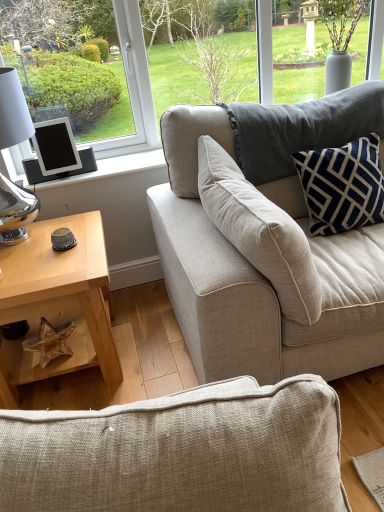
This screenshot has height=512, width=384. In order to click on light wood/texture coffee table at lower left in this screenshot , I will do `click(58, 300)`.

Where is `black matte tablet at left`? This screenshot has height=512, width=384. black matte tablet at left is located at coordinates (56, 147).

Where is `beige fabric couch at upper right`? beige fabric couch at upper right is located at coordinates (267, 241).

Locate an element on the screen. The image size is (384, 512). light wood/texture coffee table at lower left is located at coordinates (58, 300).

How different are the orientations of black matte tablet at left and beige fabric couch at upper right in degrees?

black matte tablet at left and beige fabric couch at upper right are facing 82.7 degrees away from each other.

Would you say beige fabric couch at upper right is part of black matte tablet at left's contents?

No, black matte tablet at left does not contain beige fabric couch at upper right.

This screenshot has height=512, width=384. In the image, there is a beige fabric couch at upper right. Find the location of `computer monitor above it (from the image's perspective)`. computer monitor above it (from the image's perspective) is located at coordinates (56, 147).

Are black matte tablet at left and beige fabric couch at upper right located far from each other?

black matte tablet at left is actually quite close to beige fabric couch at upper right.

Consider the image. Would you say light wood/texture coffee table at lower left is to the left or to the right of black matte tablet at left in the picture?

light wood/texture coffee table at lower left is positioned on black matte tablet at left's right side.

From a real-world perspective, between light wood/texture coffee table at lower left and black matte tablet at left, who is vertically higher?

black matte tablet at left is physically above.

Is light wood/texture coffee table at lower left bigger than black matte tablet at left?

Correct, light wood/texture coffee table at lower left is larger in size than black matte tablet at left.

Where is `coffee table that is under the black matte tablet at left (from a real-world perspective)`? The height and width of the screenshot is (512, 384). coffee table that is under the black matte tablet at left (from a real-world perspective) is located at coordinates (58, 300).

The image size is (384, 512). Identify the location of coffee table below the navy velvet pillow at upper right (from the image's perspective). (58, 300).

Can you tell me how much navy velvet pillow at upper right and light wood/texture coffee table at lower left differ in facing direction?

1.92 degrees.

From the image's perspective, between navy velvet pillow at upper right and light wood/texture coffee table at lower left, who is located below?

light wood/texture coffee table at lower left.

Is navy velvet pillow at upper right not inside light wood/texture coffee table at lower left?

Yes.

Consider the image. Considering the relative sizes of navy velvet pillow at upper right and black matte tablet at left in the image provided, is navy velvet pillow at upper right bigger than black matte tablet at left?

Yes.

Where is `computer monitor above the navy velvet pillow at upper right (from a real-world perspective)`? This screenshot has width=384, height=512. computer monitor above the navy velvet pillow at upper right (from a real-world perspective) is located at coordinates click(56, 147).

Is navy velvet pillow at upper right with black matte tablet at left?

No, navy velvet pillow at upper right is not beside black matte tablet at left.

Which is nearer, (x=383, y=176) or (x=68, y=144)?

The point (x=383, y=176) is closer.

Considering the relative positions of light wood/texture coffee table at lower left and beige fabric couch at upper right in the image provided, is light wood/texture coffee table at lower left behind beige fabric couch at upper right?

That is True.

From the image's perspective, which is below, light wood/texture coffee table at lower left or beige fabric couch at upper right?

light wood/texture coffee table at lower left.

Considering the sizes of light wood/texture coffee table at lower left and beige fabric couch at upper right in the image, is light wood/texture coffee table at lower left wider or thinner than beige fabric couch at upper right?

Clearly, light wood/texture coffee table at lower left has more width compared to beige fabric couch at upper right.

Is beige fabric couch at upper right positioned with its back to navy velvet pillow at upper right?

No, beige fabric couch at upper right is not facing away from navy velvet pillow at upper right.

Between beige fabric couch at upper right and navy velvet pillow at upper right, which one is positioned in front?

beige fabric couch at upper right is more forward.

Between beige fabric couch at upper right and navy velvet pillow at upper right, which one has smaller size?

navy velvet pillow at upper right is smaller.

Considering the positions of objects beige fabric couch at upper right and light wood/texture coffee table at lower left in the image provided, who is more to the right, beige fabric couch at upper right or light wood/texture coffee table at lower left?

beige fabric couch at upper right.

From the image's perspective, is beige fabric couch at upper right located beneath light wood/texture coffee table at lower left?

No, from the image's perspective, beige fabric couch at upper right is not below light wood/texture coffee table at lower left.

In the scene shown: Considering the sizes of objects beige fabric couch at upper right and light wood/texture coffee table at lower left in the image provided, who is thinner, beige fabric couch at upper right or light wood/texture coffee table at lower left?

beige fabric couch at upper right is thinner.

In the scene shown: How distant is beige fabric couch at upper right from light wood/texture coffee table at lower left?

They are 23.50 inches apart.

You are a GUI agent. You are given a task and a screenshot of the screen. Output one action in this format:
    pyautogui.click(x=<x>, y=<y>)
    Task: Click on the computer monitor on the left of the beige fabric couch at upper right
    
    Given the screenshot: What is the action you would take?
    pyautogui.click(x=56, y=147)

This screenshot has height=512, width=384. I want to click on coffee table below the black matte tablet at left (from the image's perspective), so click(x=58, y=300).

Looking at the image, which one is located further to light wood/texture coffee table at lower left, navy velvet pillow at upper right or beige fabric couch at upper right?

navy velvet pillow at upper right is further to light wood/texture coffee table at lower left.

Estimate the real-world distances between objects in this image. Which object is further from beige fabric couch at upper right, light wood/texture coffee table at lower left or navy velvet pillow at upper right?

light wood/texture coffee table at lower left is positioned further to the anchor beige fabric couch at upper right.

Estimate the real-world distances between objects in this image. Which object is closer to beige fabric couch at upper right, navy velvet pillow at upper right or black matte tablet at left?

navy velvet pillow at upper right lies closer to beige fabric couch at upper right than the other object.

Considering their positions, is black matte tablet at left positioned closer to light wood/texture coffee table at lower left than navy velvet pillow at upper right?

black matte tablet at left.

Which object lies nearer to the anchor point black matte tablet at left, light wood/texture coffee table at lower left or beige fabric couch at upper right?

The object closer to black matte tablet at left is light wood/texture coffee table at lower left.

Consider the image. Which object lies nearer to the anchor point navy velvet pillow at upper right, black matte tablet at left or light wood/texture coffee table at lower left?

light wood/texture coffee table at lower left.

Estimate the real-world distances between objects in this image. Which object is further from light wood/texture coffee table at lower left, navy velvet pillow at upper right or black matte tablet at left?

navy velvet pillow at upper right lies further to light wood/texture coffee table at lower left than the other object.

When comparing their distances from navy velvet pillow at upper right, does beige fabric couch at upper right or black matte tablet at left seem closer?

beige fabric couch at upper right lies closer to navy velvet pillow at upper right than the other object.

The width and height of the screenshot is (384, 512). In order to click on studio couch between light wood/texture coffee table at lower left and navy velvet pillow at upper right in the horizontal direction in this screenshot , I will do `click(267, 241)`.

Where is `coffee table between black matte tablet at left and navy velvet pillow at upper right in the horizontal direction`? This screenshot has width=384, height=512. coffee table between black matte tablet at left and navy velvet pillow at upper right in the horizontal direction is located at coordinates (58, 300).

Identify the location of coffee table between black matte tablet at left and beige fabric couch at upper right in the horizontal direction. The height and width of the screenshot is (512, 384). (58, 300).

Where is `studio couch between black matte tablet at left and navy velvet pillow at upper right`? This screenshot has width=384, height=512. studio couch between black matte tablet at left and navy velvet pillow at upper right is located at coordinates (267, 241).